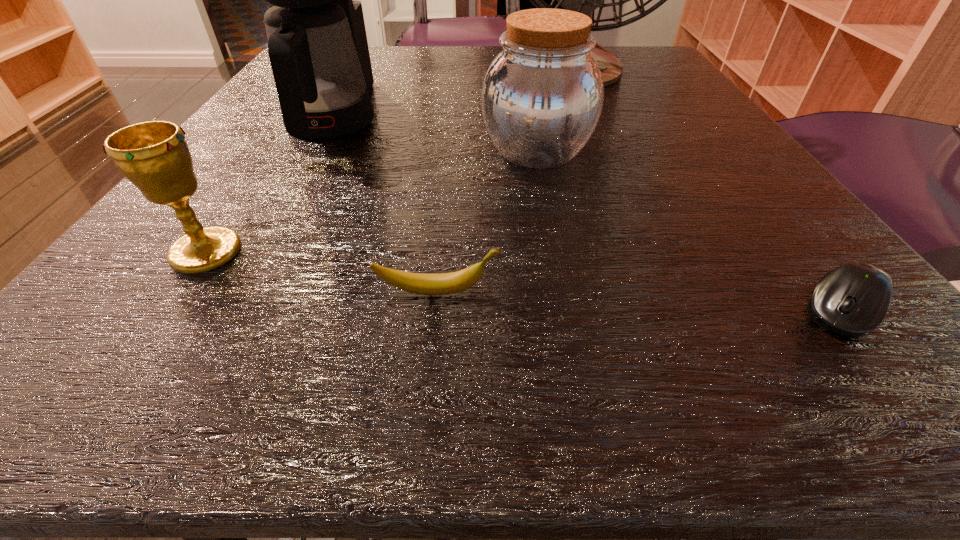
Find the location of a particular element. vacant space located on the back of the fourth tallest object is located at coordinates (256, 178).

The image size is (960, 540). What are the coordinates of `vacant area situated at the stem of the second shortest object` in the screenshot? It's located at (820, 292).

What are the coordinates of `blank area located on the back of the shortest object` in the screenshot? It's located at tap(777, 226).

You are a GUI agent. You are given a task and a screenshot of the screen. Output one action in this format:
    pyautogui.click(x=<x>, y=<y>)
    Task: Click on the fan positioned at the far edge
    This screenshot has width=960, height=540.
    Given the screenshot: What is the action you would take?
    pyautogui.click(x=585, y=0)

Where is `coffee maker that is positioned at the far edge`? Image resolution: width=960 pixels, height=540 pixels. coffee maker that is positioned at the far edge is located at coordinates (317, 44).

Find the location of a particular element. The width and height of the screenshot is (960, 540). object located in the near edge section of the desktop is located at coordinates (851, 300).

Locate an element on the screen. Image resolution: width=960 pixels, height=540 pixels. coffee maker that is at the left edge is located at coordinates (317, 44).

Locate an element on the screen. The image size is (960, 540). chalice present at the left edge is located at coordinates (154, 156).

Where is `fan that is at the right edge`? This screenshot has height=540, width=960. fan that is at the right edge is located at coordinates (585, 0).

Where is `mouse located at the right edge`? This screenshot has width=960, height=540. mouse located at the right edge is located at coordinates (851, 300).